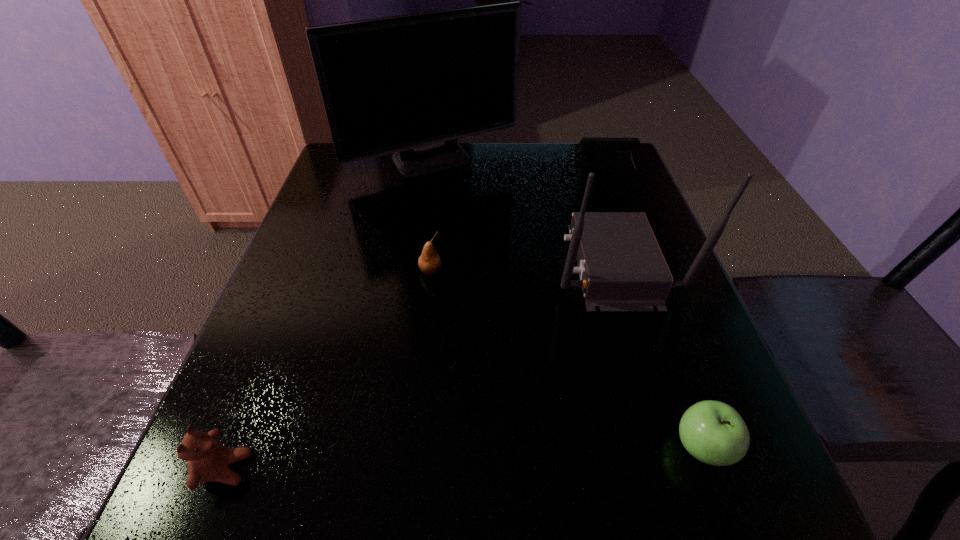
Identify the location of vacant region at the left edge of the desktop. (300, 233).

The width and height of the screenshot is (960, 540). I want to click on free spot at the right edge of the desktop, so click(671, 321).

The height and width of the screenshot is (540, 960). What are the coordinates of `blank space at the far left corner` in the screenshot? It's located at (371, 161).

Locate an element on the screen. vacant space at the far right corner of the desktop is located at coordinates (593, 180).

At what (x,y) coordinates should I click in order to perform the action: click on empty location between the teddy bear and the apple. Please return your answer as a coordinate pair (x, y). The image size is (960, 540). Looking at the image, I should click on (464, 458).

Identify the location of free spot between the tallest object and the pear. This screenshot has height=540, width=960. (432, 217).

Image resolution: width=960 pixels, height=540 pixels. What are the coordinates of `vacant point located between the pear and the teddy bear` in the screenshot? It's located at (328, 370).

The width and height of the screenshot is (960, 540). In order to click on empty location between the pear and the computer monitor in this screenshot , I will do `click(432, 217)`.

The width and height of the screenshot is (960, 540). In order to click on vacant area between the computer monitor and the fifth shortest object in this screenshot , I will do `click(523, 213)`.

Identify the location of empty space between the pear and the teddy bear. Image resolution: width=960 pixels, height=540 pixels. (328, 370).